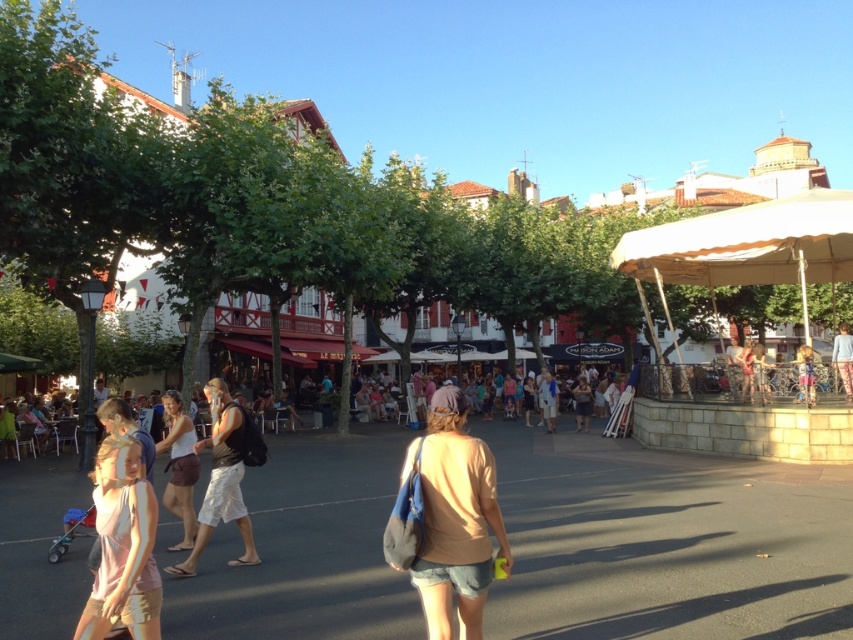
Based on the photo, you are a photographer standing in the town square. You want to take a photo of the light brown shorts at center and the blue denim shorts at lower right. Based on their positions, which one is closer to the ground?

The light brown shorts at center is below blue denim shorts at lower right, so the light brown shorts at center is closer to the ground.

You are a photographer trying to capture a photo of the denim shorts at center and the blue denim shorts at lower right. Based on their positions, which one is closer to the ground?

The denim shorts at center is below blue denim shorts at lower right, so the denim shorts at center is closer to the ground.

You are standing in the town square and want to find the denim shorts at center. According to the coordinates provided, where should you look relative to the center of the image?

The denim shorts at center are located at coordinates point (456, 518), which is slightly to the right and above the center of the image.